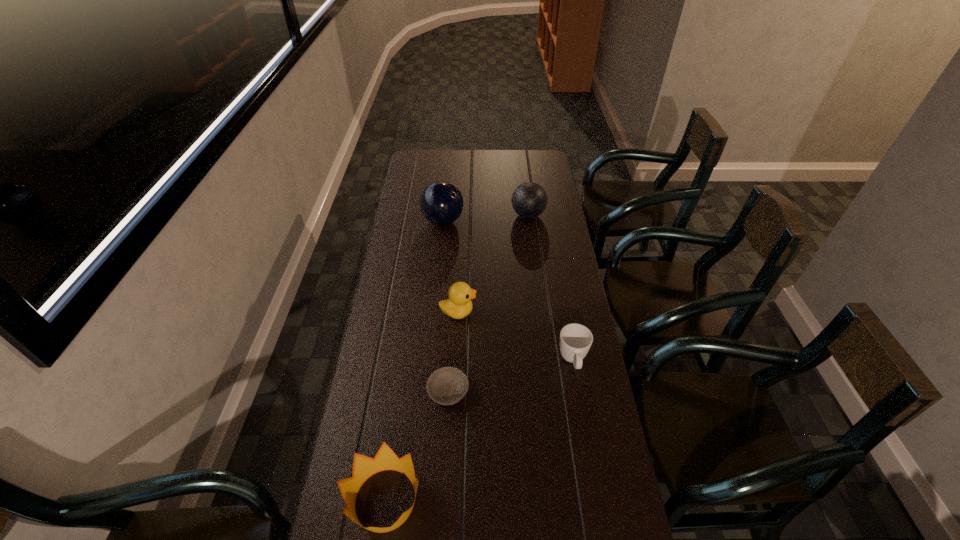
At what (x,y) coordinates should I click in order to perform the action: click on vacant region located on the face of the duck. Please return your answer as a coordinate pair (x, y). Looking at the image, I should click on (521, 312).

The image size is (960, 540). Identify the location of vacant space located with the handle on the side of the cup. (588, 448).

I want to click on free spot located on the right of the bowl, so click(x=560, y=392).

Find the location of a particular element. This screenshot has height=540, width=960. object positioned at the left edge is located at coordinates (441, 203).

This screenshot has height=540, width=960. I want to click on bowling ball that is at the right edge, so click(529, 200).

Identify the location of cup situated at the right edge. (575, 339).

Locate an element on the screen. This screenshot has height=540, width=960. vacant area at the left edge is located at coordinates (381, 359).

Image resolution: width=960 pixels, height=540 pixels. In order to click on free space at the right edge in this screenshot , I will do `click(598, 455)`.

This screenshot has height=540, width=960. I want to click on vacant space at the far right corner of the desktop, so coord(531,163).

You are a GUI agent. You are given a task and a screenshot of the screen. Output one action in this format:
    pyautogui.click(x=<x>, y=<y>)
    Task: Click on the free spot between the shorter bowling ball and the third farthest object
    Image resolution: width=960 pixels, height=540 pixels.
    Given the screenshot: What is the action you would take?
    pyautogui.click(x=493, y=264)